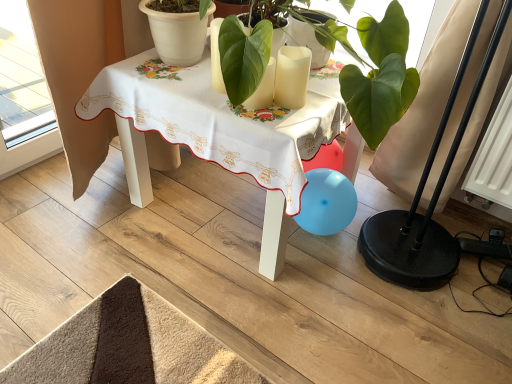
Identify the location of space that is in front of white fabric table at center. The height and width of the screenshot is (384, 512). (219, 321).